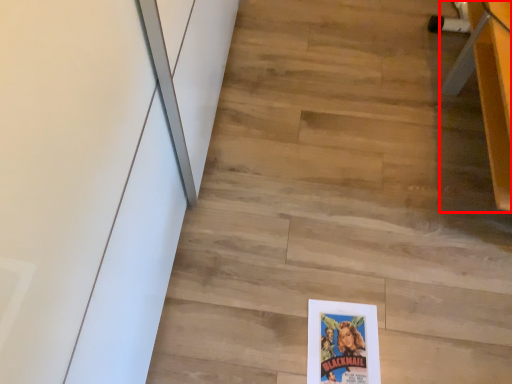
Question: In this image, where is furniture (annotated by the red box) located relative to stair?

Choices:
 (A) right
 (B) left

Answer: (A)